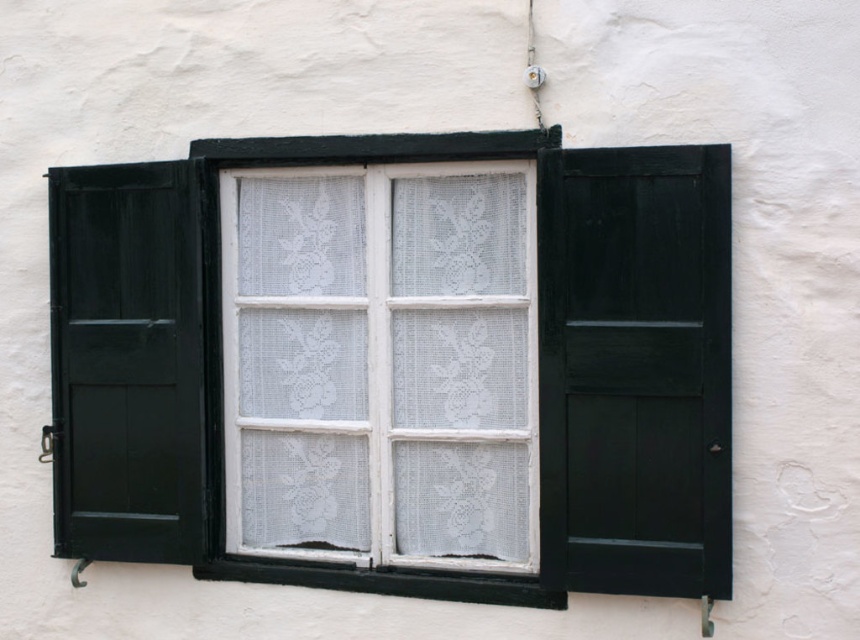
Is white lace curtain at center bigger than black rubber window sill at lower center?

Yes, white lace curtain at center is bigger than black rubber window sill at lower center.

Identify the location of white lace curtain at center. (381, 362).

Does matte black shutter at right appear under black rubber window sill at lower center?

Actually, matte black shutter at right is above black rubber window sill at lower center.

Does matte black shutter at right have a smaller size compared to black rubber window sill at lower center?

Actually, matte black shutter at right might be larger than black rubber window sill at lower center.

Which is in front, point (723, 241) or point (220, 560)?

Point (723, 241)

The width and height of the screenshot is (860, 640). Identify the location of matte black shutter at right. (636, 371).

Does white painted wood window frame at center appear under black rubber window sill at lower center?

Incorrect, white painted wood window frame at center is not positioned below black rubber window sill at lower center.

Can you confirm if white painted wood window frame at center is positioned to the left of black rubber window sill at lower center?

Yes, white painted wood window frame at center is to the left of black rubber window sill at lower center.

Where is `white painted wood window frame at center`? white painted wood window frame at center is located at coordinates pos(538,365).